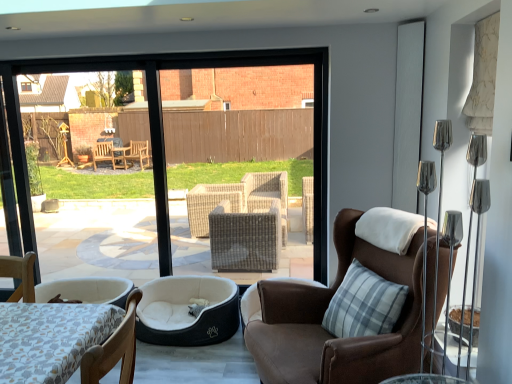
Question: Does white textured screen door at upper right have a greater height compared to dark gray plush dog bed at lower left?

Choices:
 (A) yes
 (B) no

Answer: (A)

Question: Can you confirm if white textured screen door at upper right is thinner than dark gray plush dog bed at lower left?

Choices:
 (A) no
 (B) yes

Answer: (B)

Question: Would you say white textured screen door at upper right is a long distance from dark gray plush dog bed at lower left?

Choices:
 (A) yes
 (B) no

Answer: (A)

Question: Does white textured screen door at upper right come behind dark gray plush dog bed at lower left?

Choices:
 (A) yes
 (B) no

Answer: (B)

Question: From the image's perspective, is white textured screen door at upper right located above dark gray plush dog bed at lower left?

Choices:
 (A) no
 (B) yes

Answer: (B)

Question: Is white textured screen door at upper right positioned beyond the bounds of dark gray plush dog bed at lower left?

Choices:
 (A) yes
 (B) no

Answer: (A)

Question: Is wooden chair at lower left, the 2th chair positioned from the right, wider than white textured screen door at upper right?

Choices:
 (A) yes
 (B) no

Answer: (A)

Question: Is wooden chair at lower left, the 1th chair in the left-to-right sequence, positioned with its back to white textured screen door at upper right?

Choices:
 (A) yes
 (B) no

Answer: (B)

Question: From a real-world perspective, is wooden chair at lower left, the 1th chair viewed from the front, on top of white textured screen door at upper right?

Choices:
 (A) yes
 (B) no

Answer: (B)

Question: Can you see wooden chair at lower left, the 2th chair positioned from the right, touching white textured screen door at upper right?

Choices:
 (A) no
 (B) yes

Answer: (A)

Question: Considering the relative positions of wooden chair at lower left, the 2th chair positioned from the right, and white textured screen door at upper right in the image provided, is wooden chair at lower left, the 2th chair positioned from the right, to the right of white textured screen door at upper right from the viewer's perspective?

Choices:
 (A) no
 (B) yes

Answer: (A)

Question: From a real-world perspective, is brown leather chair at center, arranged as the first chair when viewed from the right, on top of white textured screen door at upper right?

Choices:
 (A) yes
 (B) no

Answer: (B)